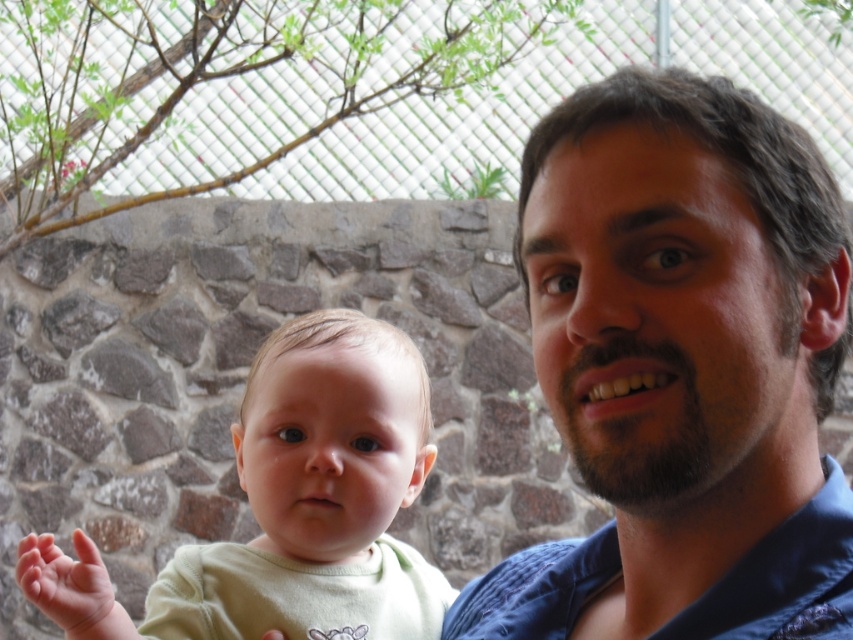
You are a photographer trying to capture a closeup of the light green fabric baby at center and the soft pink skin at lower left. Which object should you focus on first if you want to ensure both are in focus?

The light green fabric baby at center is positioned on the right side of soft pink skin at lower left, so you should focus on the soft pink skin at lower left first to ensure both are in focus.

You are designing a costume for a play and need to ensure that the dark blue fabric at center and the light green fabric baby at center can be seen clearly by the audience. Given that the stage has limited space, which object should be placed closer to the front to ensure visibility?

The light green fabric baby at center should be placed closer to the front because the dark blue fabric at center is narrower than the light green fabric baby at center, making the baby more visible when positioned forward.

You are a photographer trying to focus on the light green fabric baby at center. However, the dark blue fabric at center is blocking your view. Can you adjust your camera to focus on the baby without moving any objects?

The dark blue fabric at center is closer to the viewer than the light green fabric baby at center, so you cannot focus on the baby without moving the dark blue fabric at center closer or the baby further away.